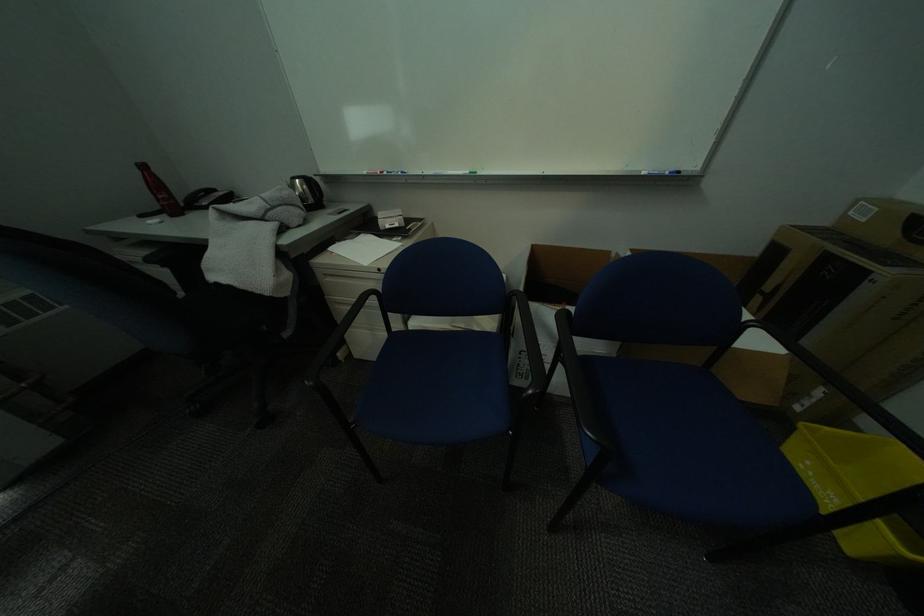
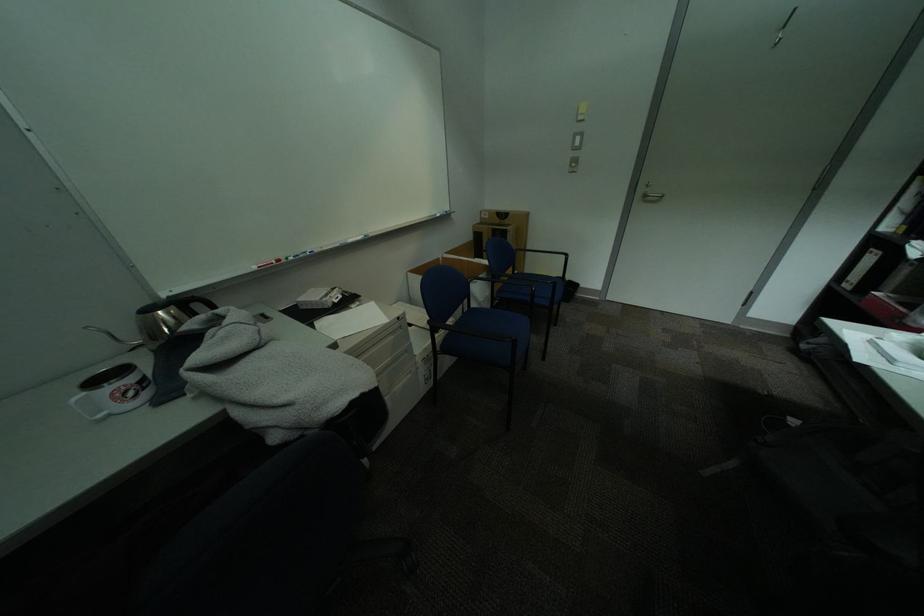
Locate, in the second image, the point that corresponds to (x=622, y=254) in the first image.

(450, 259)